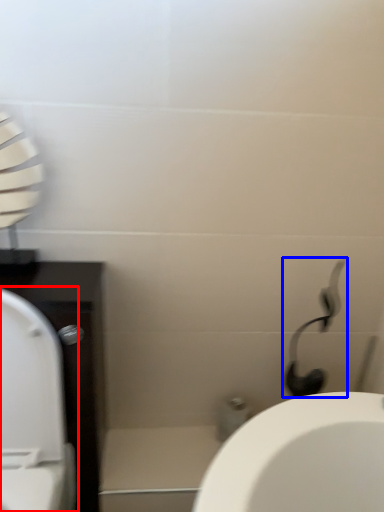
Question: Among these objects, which one is farthest to the camera, toilet (highlighted by a red box) or shower (highlighted by a blue box)?

Choices:
 (A) toilet
 (B) shower

Answer: (B)